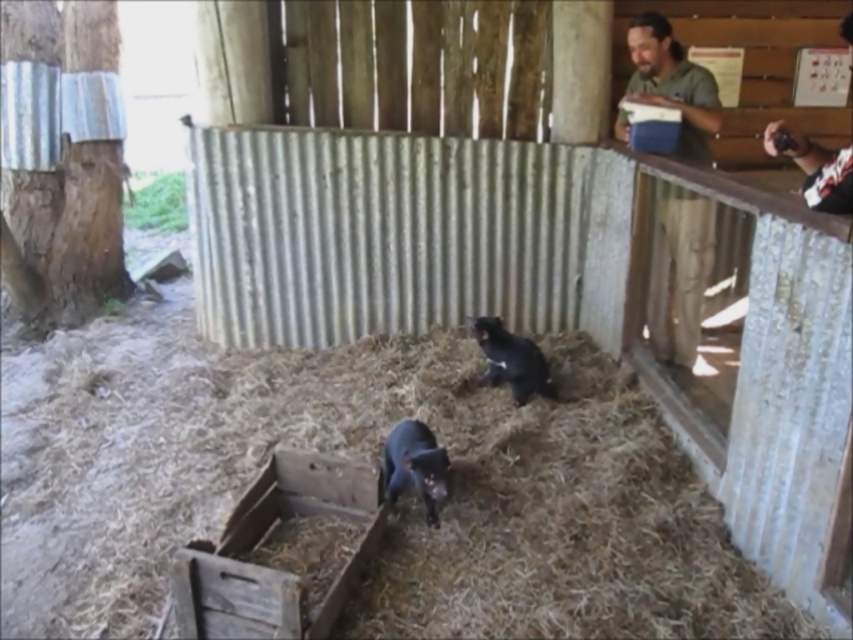
You are a zookeeper trying to locate two specific points in the barn. You know that one point is closer to you than the other. Which of the two points, point (303, 497) or point (645, 20), is nearer to your current position?

Point (303, 497) is closer to the camera than point (645, 20), so the point (303, 497) is nearer to your current position.

You are a zookeeper who needs to place a new feeding tray for the Tasmanian devils. The tray must be placed between the rusty wooden crate at lower left and the green matte shirt at upper right. Which object should you place the tray closer to if you want it to be closer to the front of the enclosure?

The tray should be placed closer to the rusty wooden crate at lower left because it is in front of the green matte shirt at upper right, making it closer to the front of the enclosure.

You are a zookeeper who needs to clean the trough. You see the green matte shirt at upper right and the black matte animal at center. Which object is higher up in the image?

The green matte shirt at upper right is located above the black matte animal at center, so it is higher up in the image.